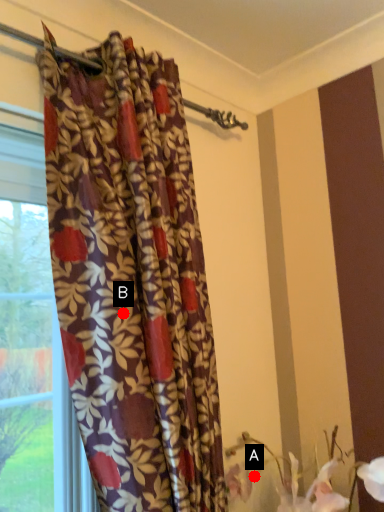
Question: Two points are circled on the image, labeled by A and B beside each circle. Which point is closer to the camera?

Choices:
 (A) A is closer
 (B) B is closer

Answer: (B)